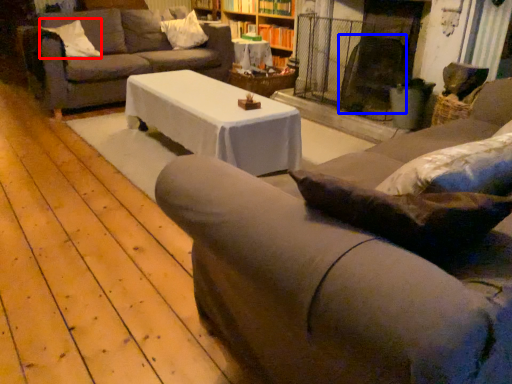
Question: Which object is closer to the camera taking this photo, pillow (highlighted by a red box) or swivel chair (highlighted by a blue box)?

Choices:
 (A) pillow
 (B) swivel chair

Answer: (B)